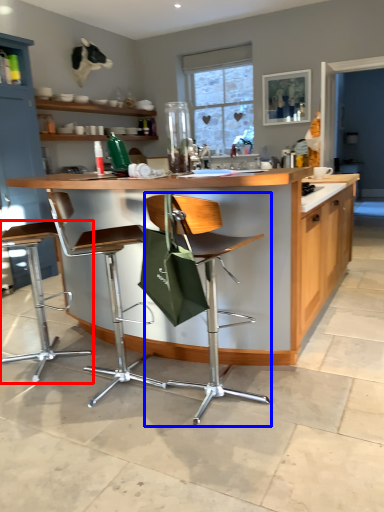
Question: Which object is further to the camera taking this photo, chair (highlighted by a red box) or chair (highlighted by a blue box)?

Choices:
 (A) chair
 (B) chair

Answer: (A)